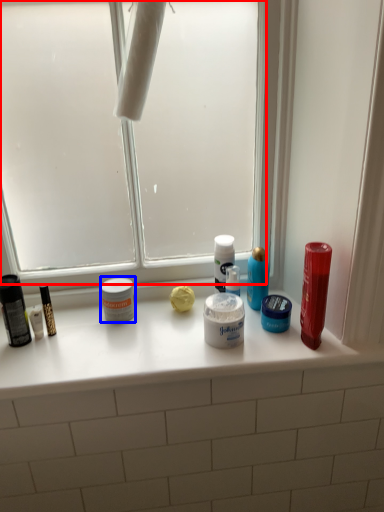
Question: Which of the following is the closest to the observer, window screen (highlighted by a red box) or toiletry (highlighted by a blue box)?

Choices:
 (A) window screen
 (B) toiletry

Answer: (A)